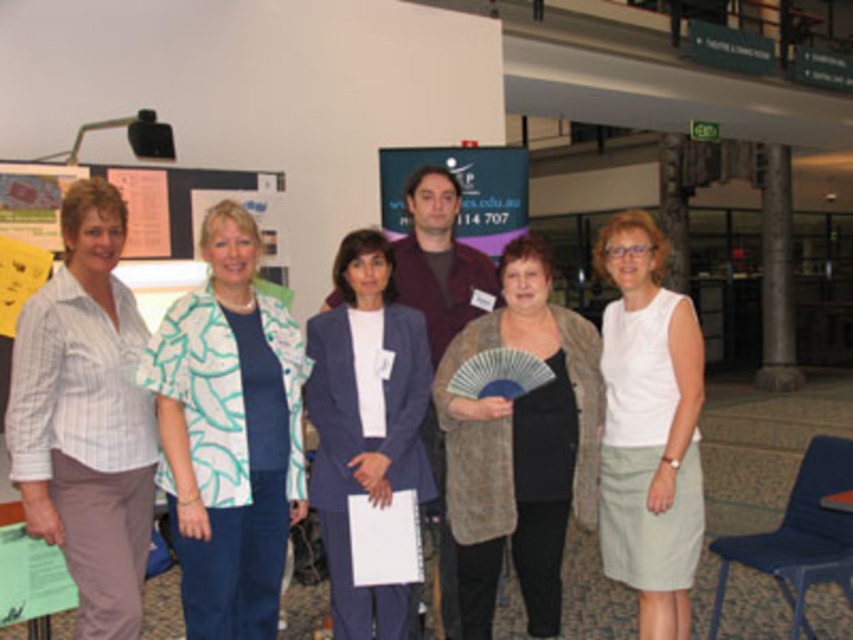
Question: Considering the real-world distances, which object is farthest from the beige textured cardigan at center?

Choices:
 (A) printed fabric shirt at left
 (B) striped cotton shirt at left

Answer: (B)

Question: Is printed fabric shirt at left behind matte blue suit at center?

Choices:
 (A) yes
 (B) no

Answer: (B)

Question: Is matte blue suit at center above matte plastic poster at center?

Choices:
 (A) no
 (B) yes

Answer: (A)

Question: Which of the following is the farthest from the observer?

Choices:
 (A) blue plastic chair at lower right
 (B) white fabric shirt at center
 (C) printed fabric shirt at left

Answer: (A)

Question: Is blue plastic chair at lower right in front of matte plastic poster at center?

Choices:
 (A) no
 (B) yes

Answer: (B)

Question: Which point is closer to the camera taking this photo?

Choices:
 (A) (679, 552)
 (B) (781, 541)

Answer: (A)